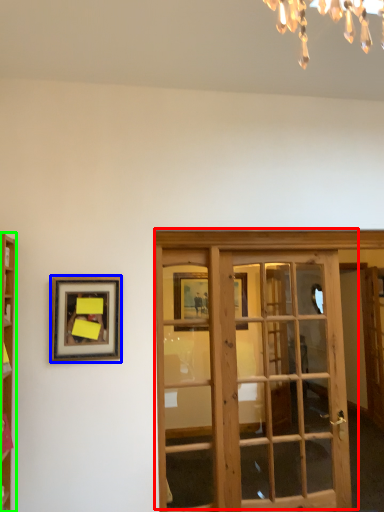
Question: Estimate the real-world distances between objects in this image. Which object is closer to door (highlighted by a red box), picture frame (highlighted by a blue box) or cabinetry (highlighted by a green box)?

Choices:
 (A) picture frame
 (B) cabinetry

Answer: (A)